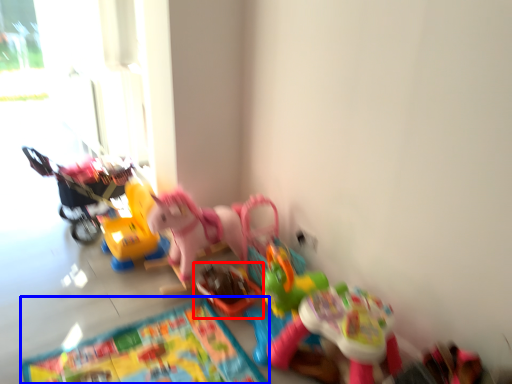
Question: Which of the following is the closest to the observer, toy (highlighted by a red box) or mat (highlighted by a blue box)?

Choices:
 (A) toy
 (B) mat

Answer: (B)